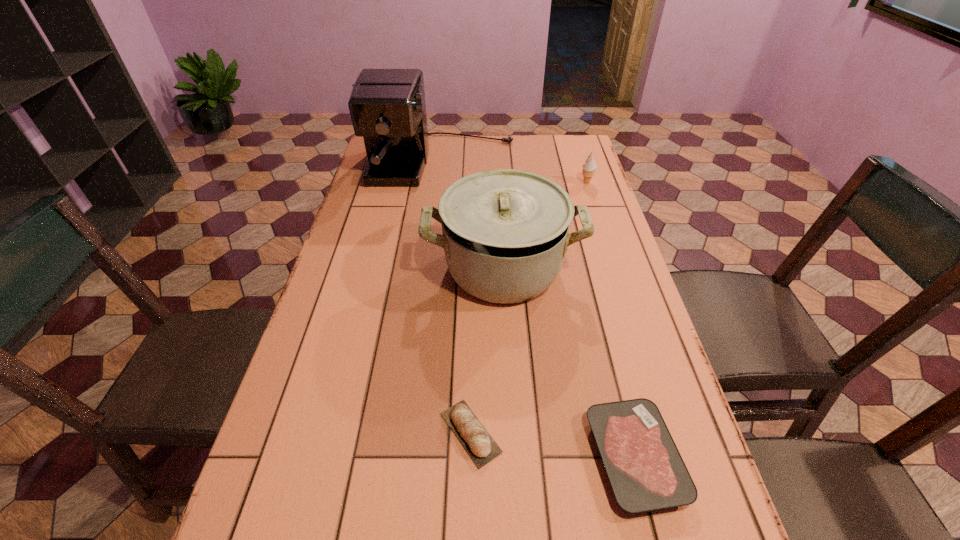
The width and height of the screenshot is (960, 540). What are the coordinates of `free space located 0.190m on the left of the steak` in the screenshot? It's located at (489, 457).

Where is `object at the far edge`? object at the far edge is located at coordinates point(387,107).

At what (x,y) coordinates should I click in order to perform the action: click on object that is at the left edge. Please return your answer as a coordinate pair (x, y). Looking at the image, I should click on (387, 107).

At what (x,y) coordinates should I click in order to perform the action: click on saucepan that is at the right edge. Please return your answer as a coordinate pair (x, y). The height and width of the screenshot is (540, 960). Looking at the image, I should click on (505, 232).

Where is `icecream that is at the right edge`? This screenshot has height=540, width=960. icecream that is at the right edge is located at coordinates (589, 167).

In order to click on steak that is at the right edge in this screenshot , I will do `click(646, 471)`.

Find the location of a particular element. Image resolution: width=960 pixels, height=540 pixels. object located in the far left corner section of the desktop is located at coordinates (387, 107).

Identify the location of vacant region at the left edge of the desktop. (366, 187).

You are a GUI agent. You are given a task and a screenshot of the screen. Output one action in this format:
    pyautogui.click(x=<x>, y=<y>)
    Task: Click on the free location at the right edge of the desktop
    The width and height of the screenshot is (960, 540).
    Given the screenshot: What is the action you would take?
    pyautogui.click(x=665, y=363)

This screenshot has width=960, height=540. Identify the location of vacant space at the far right corner of the desktop. (563, 145).